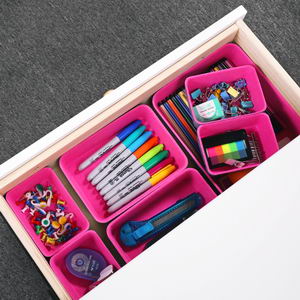
This screenshot has width=300, height=300. Find the location of `bins`. bins is located at coordinates (43, 178), (73, 157), (86, 242), (145, 208), (252, 125), (254, 93), (276, 102).